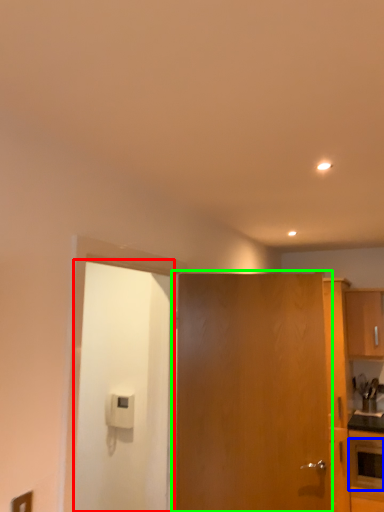
Question: Estimate the real-world distances between objects in this image. Which object is farther from door (highlighted by a red box), appliance (highlighted by a blue box) or door (highlighted by a green box)?

Choices:
 (A) appliance
 (B) door

Answer: (A)